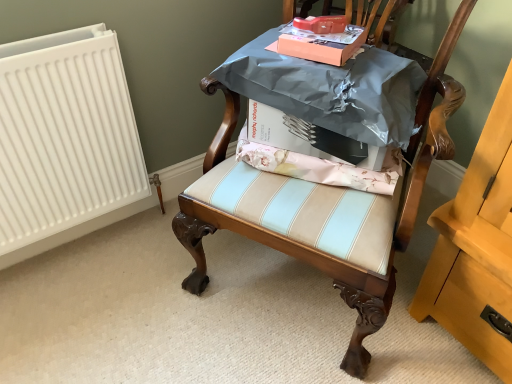
What is the approximate height of wooden chair at center?

37.16 inches.

The height and width of the screenshot is (384, 512). What do you see at coordinates (298, 136) in the screenshot?
I see `white cardboard box at center, which ranks as the first cardboard box in bottom-to-top order` at bounding box center [298, 136].

You are a GUI agent. You are given a task and a screenshot of the screen. Output one action in this format:
    pyautogui.click(x=<x>, y=<y>)
    Task: Click on the matte orange cardboard box at upper center, the 2th cardboard box positioned from the bottom
    
    Given the screenshot: What is the action you would take?
    pyautogui.click(x=321, y=44)

Could you tell me if white cardboard box at center, which is the 2th cardboard box from top to bottom, is facing wooden chair at center?

Yes, white cardboard box at center, which is the 2th cardboard box from top to bottom, is aimed at wooden chair at center.

Is white cardboard box at center, which is the 2th cardboard box from top to bottom, far from wooden chair at center?

white cardboard box at center, which is the 2th cardboard box from top to bottom, is near wooden chair at center, not far away.

Between white cardboard box at center, which is the 2th cardboard box from top to bottom, and wooden chair at center, which one has larger size?

wooden chair at center.

Is the position of white cardboard box at center, which is the 2th cardboard box from top to bottom, more distant than that of wooden chair at center?

Yes, white cardboard box at center, which is the 2th cardboard box from top to bottom, is further from the camera.

Based on the photo, from a real-world perspective, is white cardboard box at center, which ranks as the first cardboard box in bottom-to-top order, below matte orange cardboard box at upper center, the first cardboard box in the top-to-bottom sequence?

Yes, from a real-world perspective, white cardboard box at center, which ranks as the first cardboard box in bottom-to-top order, is below matte orange cardboard box at upper center, the first cardboard box in the top-to-bottom sequence.

Is white cardboard box at center, which is the 2th cardboard box from top to bottom, shorter than matte orange cardboard box at upper center, the first cardboard box in the top-to-bottom sequence?

Incorrect, the height of white cardboard box at center, which is the 2th cardboard box from top to bottom, does not fall short of that of matte orange cardboard box at upper center, the first cardboard box in the top-to-bottom sequence.

Can you tell me how much white cardboard box at center, which ranks as the first cardboard box in bottom-to-top order, and matte orange cardboard box at upper center, the 2th cardboard box positioned from the bottom, differ in facing direction?

white cardboard box at center, which ranks as the first cardboard box in bottom-to-top order, and matte orange cardboard box at upper center, the 2th cardboard box positioned from the bottom, are facing 9.89 degrees away from each other.

Is white cardboard box at center, which ranks as the first cardboard box in bottom-to-top order, oriented away from matte orange cardboard box at upper center, the first cardboard box in the top-to-bottom sequence?

No, white cardboard box at center, which ranks as the first cardboard box in bottom-to-top order,'s orientation is not away from matte orange cardboard box at upper center, the first cardboard box in the top-to-bottom sequence.

Considering the relative sizes of matte orange cardboard box at upper center, the first cardboard box in the top-to-bottom sequence, and white cardboard box at center, which is the 2th cardboard box from top to bottom, in the image provided, is matte orange cardboard box at upper center, the first cardboard box in the top-to-bottom sequence, bigger than white cardboard box at center, which is the 2th cardboard box from top to bottom,?

No.

Looking at their sizes, would you say matte orange cardboard box at upper center, the first cardboard box in the top-to-bottom sequence, is wider or thinner than white cardboard box at center, which is the 2th cardboard box from top to bottom?

Clearly, matte orange cardboard box at upper center, the first cardboard box in the top-to-bottom sequence, has less width compared to white cardboard box at center, which is the 2th cardboard box from top to bottom.

Does point (336, 49) come closer to viewer compared to point (316, 155)?

Yes, it is.

How different are the orientations of matte orange cardboard box at upper center, the 2th cardboard box positioned from the bottom, and white cardboard box at center, which is the 2th cardboard box from top to bottom, in degrees?

The angle between the facing direction of matte orange cardboard box at upper center, the 2th cardboard box positioned from the bottom, and the facing direction of white cardboard box at center, which is the 2th cardboard box from top to bottom, is 9.89 degrees.

Which of these two, pink floral fabric at center or white cardboard box at center, which ranks as the first cardboard box in bottom-to-top order, is smaller?

pink floral fabric at center.

Where is `fabric below the white cardboard box at center, which ranks as the first cardboard box in bottom-to-top order (from a real-world perspective)`? The width and height of the screenshot is (512, 384). fabric below the white cardboard box at center, which ranks as the first cardboard box in bottom-to-top order (from a real-world perspective) is located at coordinates click(x=321, y=167).

Can you tell me how much pink floral fabric at center and white cardboard box at center, which is the 2th cardboard box from top to bottom, differ in facing direction?

They differ by 3.38 degrees in their facing directions.

Is pink floral fabric at center at the right side of white cardboard box at center, which is the 2th cardboard box from top to bottom?

No.

Would you say pink floral fabric at center is part of wooden chair at center's contents?

Yes, pink floral fabric at center is a part of wooden chair at center.

Is wooden chair at center directly adjacent to pink floral fabric at center?

No, wooden chair at center is not with pink floral fabric at center.

The width and height of the screenshot is (512, 384). Identify the location of chair directly beneath the pink floral fabric at center (from a real-world perspective). (367, 213).

Is pink floral fabric at center looking in the opposite direction of wooden chair at center?

Yes, wooden chair at center is at the back of pink floral fabric at center.

Which of these two, pink floral fabric at center or wooden chair at center, is thinner?

Thinner between the two is pink floral fabric at center.

Considering the points (293, 169) and (315, 262), which point is in front, point (293, 169) or point (315, 262)?

The point (315, 262) is more forward.

Are pink floral fabric at center and wooden chair at center located far from each other?

That's not correct — pink floral fabric at center is a little close to wooden chair at center.

Is point (280, 118) positioned behind point (243, 156)?

No, it is in front of (243, 156).

Is white cardboard box at center, which ranks as the first cardboard box in bottom-to-top order, shorter than pink floral fabric at center?

Incorrect, the height of white cardboard box at center, which ranks as the first cardboard box in bottom-to-top order, does not fall short of that of pink floral fabric at center.

Is white cardboard box at center, which is the 2th cardboard box from top to bottom, looking in the opposite direction of pink floral fabric at center?

That's not correct — white cardboard box at center, which is the 2th cardboard box from top to bottom, is not looking away from pink floral fabric at center.

In the image, is white cardboard box at center, which ranks as the first cardboard box in bottom-to-top order, positioned in front of or behind pink floral fabric at center?

Clearly, white cardboard box at center, which ranks as the first cardboard box in bottom-to-top order, is in front of pink floral fabric at center.

Image resolution: width=512 pixels, height=384 pixels. There is a wooden chair at center. Identify the location of the 1st cardboard box above it (from the image's perspective). (298, 136).

The height and width of the screenshot is (384, 512). In order to click on cardboard box behind the matte orange cardboard box at upper center, the 2th cardboard box positioned from the bottom in this screenshot , I will do `click(298, 136)`.

Looking at the image, which one is located closer to matte orange cardboard box at upper center, the first cardboard box in the top-to-bottom sequence, pink floral fabric at center or wooden chair at center?

pink floral fabric at center is positioned closer to the anchor matte orange cardboard box at upper center, the first cardboard box in the top-to-bottom sequence.

From the image, which object appears to be farther from pink floral fabric at center, matte orange cardboard box at upper center, the first cardboard box in the top-to-bottom sequence, or white cardboard box at center, which is the 2th cardboard box from top to bottom?

Among the two, matte orange cardboard box at upper center, the first cardboard box in the top-to-bottom sequence, is located further to pink floral fabric at center.

From the image, which object appears to be nearer to white cardboard box at center, which is the 2th cardboard box from top to bottom, wooden chair at center or matte orange cardboard box at upper center, the 2th cardboard box positioned from the bottom?

Among the two, matte orange cardboard box at upper center, the 2th cardboard box positioned from the bottom, is located nearer to white cardboard box at center, which is the 2th cardboard box from top to bottom.

Which object lies nearer to the anchor point matte orange cardboard box at upper center, the first cardboard box in the top-to-bottom sequence, wooden chair at center or white cardboard box at center, which is the 2th cardboard box from top to bottom?

white cardboard box at center, which is the 2th cardboard box from top to bottom.

From the image, which object appears to be nearer to pink floral fabric at center, white cardboard box at center, which ranks as the first cardboard box in bottom-to-top order, or wooden chair at center?

Among the two, white cardboard box at center, which ranks as the first cardboard box in bottom-to-top order, is located nearer to pink floral fabric at center.

Based on the photo, considering their positions, is matte orange cardboard box at upper center, the 2th cardboard box positioned from the bottom, positioned closer to pink floral fabric at center than wooden chair at center?

Based on the image, wooden chair at center appears to be nearer to pink floral fabric at center.

Based on their spatial positions, is white cardboard box at center, which is the 2th cardboard box from top to bottom, or matte orange cardboard box at upper center, the first cardboard box in the top-to-bottom sequence, closer to pink floral fabric at center?

white cardboard box at center, which is the 2th cardboard box from top to bottom.

Estimate the real-world distances between objects in this image. Which object is further from white cardboard box at center, which is the 2th cardboard box from top to bottom, pink floral fabric at center or matte orange cardboard box at upper center, the 2th cardboard box positioned from the bottom?

matte orange cardboard box at upper center, the 2th cardboard box positioned from the bottom, is positioned further to the anchor white cardboard box at center, which is the 2th cardboard box from top to bottom.

Image resolution: width=512 pixels, height=384 pixels. In order to click on cardboard box located between wooden chair at center and white cardboard box at center, which is the 2th cardboard box from top to bottom, in the depth direction in this screenshot , I will do `click(321, 44)`.

The image size is (512, 384). Find the location of `cardboard box between matte orange cardboard box at upper center, the first cardboard box in the top-to-bottom sequence, and pink floral fabric at center in the up-down direction`. cardboard box between matte orange cardboard box at upper center, the first cardboard box in the top-to-bottom sequence, and pink floral fabric at center in the up-down direction is located at coordinates (298, 136).